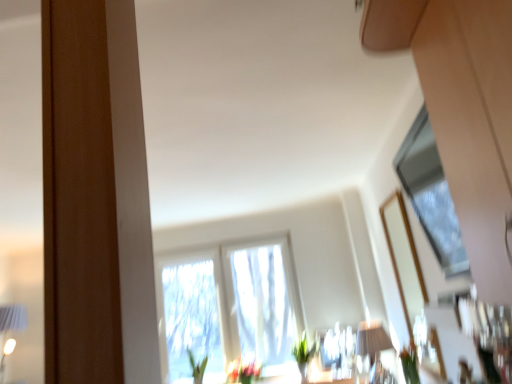
Measure the distance between translucent fabric window at center, the 2th window positioned from the right, and camera.

translucent fabric window at center, the 2th window positioned from the right, and camera are 4.29 meters apart.

The width and height of the screenshot is (512, 384). Describe the element at coordinates (243, 371) in the screenshot. I see `translucent glass vase at center` at that location.

This screenshot has height=384, width=512. Describe the element at coordinates (372, 339) in the screenshot. I see `matte white table lamp at lower center` at that location.

What is the approximate width of green matte vase at lower center, which ranks as the 1th plant in left-to-right order?

The width of green matte vase at lower center, which ranks as the 1th plant in left-to-right order, is 10.10 inches.

This screenshot has width=512, height=384. I want to click on translucent fabric window at center, arranged as the 1th window when ordered from the bottom, so click(228, 307).

From a real-world perspective, is matte white table lamp at lower center over green matte vase at lower center, the second plant positioned from the front?

Yes, from a real-world perspective, matte white table lamp at lower center is over green matte vase at lower center, the second plant positioned from the front

Which object is wider, matte white table lamp at lower center or green matte vase at lower center, acting as the 1th plant starting from the back?

Wider between the two is matte white table lamp at lower center.

Who is shorter, matte white table lamp at lower center or green matte vase at lower center, the second plant positioned from the front?

Standing shorter between the two is green matte vase at lower center, the second plant positioned from the front.

Between translucent fabric window at center, the 2th window positioned from the right, and matte white table lamp at lower center, which one appears on the right side from the viewer's perspective?

matte white table lamp at lower center.

How much distance is there between translucent fabric window at center, which is the second window from front to back, and matte white table lamp at lower center?

translucent fabric window at center, which is the second window from front to back, and matte white table lamp at lower center are 4.36 feet apart.

From the image's perspective, relative to matte white table lamp at lower center, is translucent fabric window at center, the 2th window positioned from the right, above or below?

Based on their image positions, translucent fabric window at center, the 2th window positioned from the right, is located beneath matte white table lamp at lower center.

Does translucent fabric window at center, the 2th window positioned from the right, have a lesser height compared to matte white table lamp at lower center?

Incorrect, the height of translucent fabric window at center, the 2th window positioned from the right, does not fall short of that of matte white table lamp at lower center.

What are the coordinates of `flower below the green matte vase at lower center, which ranks as the 1th plant in left-to-right order (from a real-world perspective)` in the screenshot? It's located at (243, 371).

Does point (312, 353) come behind point (241, 381)?

No, it is in front of (241, 381).

Would you say green matte vase at lower center, marked as the 2th plant in a right-to-left arrangement, is outside translucent glass vase at center?

Absolutely, green matte vase at lower center, marked as the 2th plant in a right-to-left arrangement, is external to translucent glass vase at center.

Is green matte vase at lower center, the 2th plant from the top, next to translucent glass vase at center and touching it?

No, green matte vase at lower center, the 2th plant from the top, is not making contact with translucent glass vase at center.

Which point is more distant from viewer, (301, 375) or (259, 287)?

Point (259, 287)

From the image's perspective, which object appears higher, green matte vase at lower center, acting as the 1th plant starting from the back, or translucent fabric window at center, the second window in the top-to-bottom sequence?

From the image's view, translucent fabric window at center, the second window in the top-to-bottom sequence, is above.

Is green matte vase at lower center, the second plant positioned from the front, completely or partially outside of translucent fabric window at center, arranged as the 1th window when ordered from the bottom?

Yes.

Considering the points (360, 334) and (241, 359), which point is in front, point (360, 334) or point (241, 359)?

Positioned in front is point (360, 334).

Does matte white table lamp at lower center have a lesser height compared to translucent glass vase at center?

In fact, matte white table lamp at lower center may be taller than translucent glass vase at center.

You are a GUI agent. You are given a task and a screenshot of the screen. Output one action in this format:
    pyautogui.click(x=<x>, y=<y>)
    Task: Click on the table lamp that appears above the translucent glass vase at center (from a real-world perspective)
    
    Given the screenshot: What is the action you would take?
    pyautogui.click(x=372, y=339)

In the image, is matte white table lamp at lower center positioned in front of or behind translucent glass vase at center?

Visually, matte white table lamp at lower center is located in front of translucent glass vase at center.

Considering the relative sizes of green matte plant at lower right, acting as the second plant starting from the bottom, and transparent glass window at upper right, arranged as the 1th window when viewed from the right, in the image provided, is green matte plant at lower right, acting as the second plant starting from the bottom, shorter than transparent glass window at upper right, arranged as the 1th window when viewed from the right,?

Yes, green matte plant at lower right, acting as the second plant starting from the bottom, is shorter than transparent glass window at upper right, arranged as the 1th window when viewed from the right.

Is green matte plant at lower right, arranged as the second plant when viewed from the back, turned away from transparent glass window at upper right, arranged as the 1th window when viewed from the right?

No.

From the image's perspective, is green matte plant at lower right, the 1th plant in the top-to-bottom sequence, above transparent glass window at upper right, which appears as the second window when ordered from the bottom?

No, from the image's perspective, green matte plant at lower right, the 1th plant in the top-to-bottom sequence, is not on top of transparent glass window at upper right, which appears as the second window when ordered from the bottom.

Which is more to the left, green matte plant at lower right, which is the 2th plant from left to right, or transparent glass window at upper right, the 1th window when ordered from top to bottom?

From the viewer's perspective, transparent glass window at upper right, the 1th window when ordered from top to bottom, appears more on the left side.

Is green matte plant at lower right, which is the 2th plant from left to right, far from green matte vase at lower center, the 2th plant from the top?

green matte plant at lower right, which is the 2th plant from left to right, is far away from green matte vase at lower center, the 2th plant from the top.

In the scene shown: From a real-world perspective, which is physically above, green matte plant at lower right, arranged as the second plant when viewed from the back, or green matte vase at lower center, the second plant positioned from the front?

green matte plant at lower right, arranged as the second plant when viewed from the back, from a real-world perspective.

Considering the points (407, 376) and (305, 348), which point is behind, point (407, 376) or point (305, 348)?

Point (305, 348)

Based on their positions, is green matte plant at lower right, acting as the second plant starting from the bottom, located to the left or right of green matte vase at lower center, marked as the 2th plant in a right-to-left arrangement?

In the image, green matte plant at lower right, acting as the second plant starting from the bottom, appears on the right side of green matte vase at lower center, marked as the 2th plant in a right-to-left arrangement.

Image resolution: width=512 pixels, height=384 pixels. I want to click on plant below the matte white table lamp at lower center (from the image's perspective), so click(303, 356).

This screenshot has width=512, height=384. There is a matte white table lamp at lower center. In order to click on the 1st window above it (from a real-world perspective) in this screenshot , I will do `click(228, 307)`.

Looking at the image, which one is located closer to translucent fabric window at center, which is the second window from front to back, translucent glass vase at center or green matte vase at lower center, acting as the 1th plant starting from the back?

Among the two, translucent glass vase at center is located nearer to translucent fabric window at center, which is the second window from front to back.

When comparing their distances from green matte vase at lower center, the 2th plant from the top, does translucent fabric window at center, the 1th window in the back-to-front sequence, or transparent glass window at upper right, the 1th window when ordered from top to bottom, seem closer?

Based on the image, translucent fabric window at center, the 1th window in the back-to-front sequence, appears to be nearer to green matte vase at lower center, the 2th plant from the top.

Which object lies nearer to the anchor point green matte plant at lower right, the 1th plant from the right, green matte vase at lower center, which ranks as the 1th plant in left-to-right order, or matte white table lamp at lower center?

matte white table lamp at lower center.

Consider the image. Which object lies nearer to the anchor point matte white table lamp at lower center, translucent fabric window at center, which is the second window from front to back, or green matte vase at lower center, acting as the 1th plant starting from the back?

green matte vase at lower center, acting as the 1th plant starting from the back, lies closer to matte white table lamp at lower center than the other object.

Based on their spatial positions, is transparent glass window at upper right, arranged as the 1th window when viewed from the right, or matte white table lamp at lower center closer to green matte vase at lower center, which ranks as the 1th plant in left-to-right order?

matte white table lamp at lower center.

In the scene shown: Looking at the image, which one is located closer to translucent glass vase at center, green matte plant at lower right, the 1th plant in the top-to-bottom sequence, or transparent glass window at upper right, the 1th window when ordered from top to bottom?

green matte plant at lower right, the 1th plant in the top-to-bottom sequence, is positioned closer to the anchor translucent glass vase at center.

Considering their positions, is matte white table lamp at lower center positioned closer to translucent fabric window at center, which is the second window from front to back, than green matte vase at lower center, marked as the 2th plant in a right-to-left arrangement?

Based on the image, green matte vase at lower center, marked as the 2th plant in a right-to-left arrangement, appears to be nearer to translucent fabric window at center, which is the second window from front to back.

Looking at the image, which one is located further to matte white table lamp at lower center, green matte plant at lower right, the 1th plant in the top-to-bottom sequence, or transparent glass window at upper right, which appears as the first window when viewed from the front?

Based on the image, transparent glass window at upper right, which appears as the first window when viewed from the front, appears to be further to matte white table lamp at lower center.

Where is `flower between transparent glass window at upper right, the 1th window when ordered from top to bottom, and translucent fabric window at center, the 2th window positioned from the right, from front to back`? The height and width of the screenshot is (384, 512). flower between transparent glass window at upper right, the 1th window when ordered from top to bottom, and translucent fabric window at center, the 2th window positioned from the right, from front to back is located at coordinates (243, 371).

This screenshot has height=384, width=512. Identify the location of plant between matte white table lamp at lower center and translucent glass vase at center in the front-back direction. point(303,356).

You are a GUI agent. You are given a task and a screenshot of the screen. Output one action in this format:
    pyautogui.click(x=<x>, y=<y>)
    Task: Click on the table lamp located between transparent glass window at upper right, which appears as the second window when ordered from the bottom, and translucent fabric window at center, the 2th window positioned from the right, in the depth direction
    
    Given the screenshot: What is the action you would take?
    pyautogui.click(x=372, y=339)

Where is `plant positioned between green matte plant at lower right, which is the 2th plant from left to right, and translucent fabric window at center, arranged as the 1th window when ordered from the bottom, from near to far`? Image resolution: width=512 pixels, height=384 pixels. plant positioned between green matte plant at lower right, which is the 2th plant from left to right, and translucent fabric window at center, arranged as the 1th window when ordered from the bottom, from near to far is located at coordinates (303, 356).